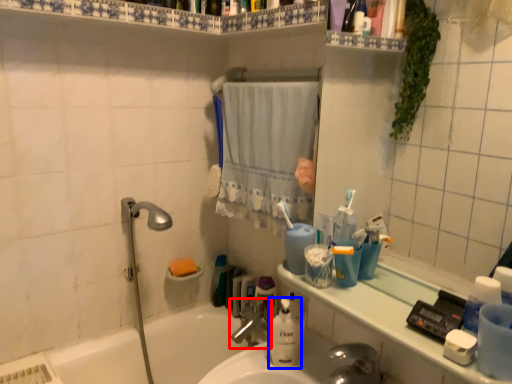
Question: Among these objects, which one is nearest to the camera, tap (highlighted by a red box) or cleaning product (highlighted by a blue box)?

Choices:
 (A) tap
 (B) cleaning product

Answer: (B)